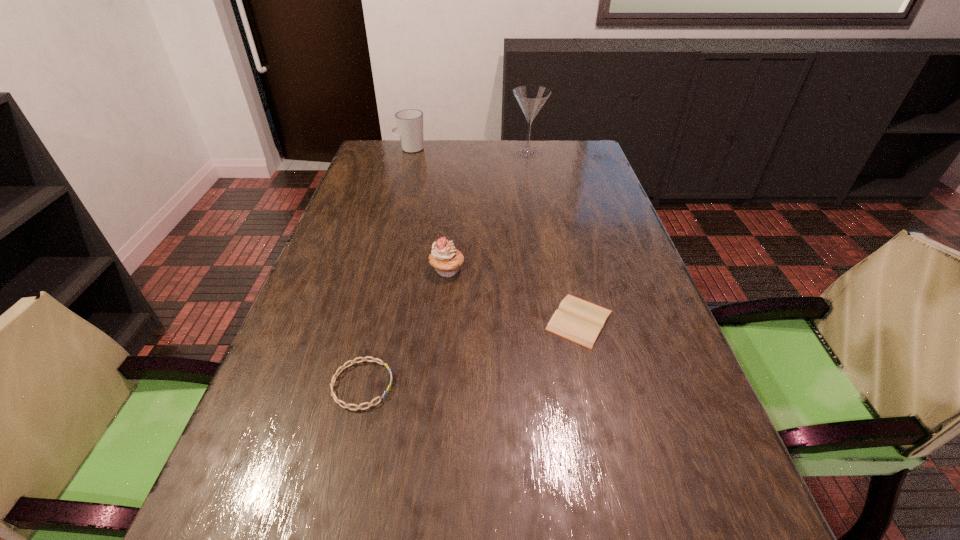
Locate an element on the screen. Image resolution: width=960 pixels, height=540 pixels. flute glass is located at coordinates (531, 98).

Locate an element on the screen. This screenshot has width=960, height=540. cup is located at coordinates (409, 122).

You are a GUI agent. You are given a task and a screenshot of the screen. Output one action in this format:
    pyautogui.click(x=<x>, y=<y>)
    Task: Click on the third nearest object
    This screenshot has height=540, width=960.
    Given the screenshot: What is the action you would take?
    pyautogui.click(x=445, y=258)

The width and height of the screenshot is (960, 540). I want to click on the third shortest object, so click(445, 258).

At what (x,y) coordinates should I click in order to perform the action: click on diary. Please return your answer as a coordinate pair (x, y). This screenshot has width=960, height=540. Looking at the image, I should click on (577, 320).

Find the location of `bracelet`. bracelet is located at coordinates (343, 367).

What are the coordinates of `free point located 0.380m on the left of the tallest object` in the screenshot? It's located at (403, 152).

Locate an element on the screen. The image size is (960, 540). free space located with a handle on the side of the second tallest object is located at coordinates pyautogui.click(x=381, y=148).

Identify the location of vacant space located 0.340m on the back of the third farthest object. (454, 191).

In order to click on vacant space located 0.050m on the right of the diary in this screenshot , I will do 638,320.